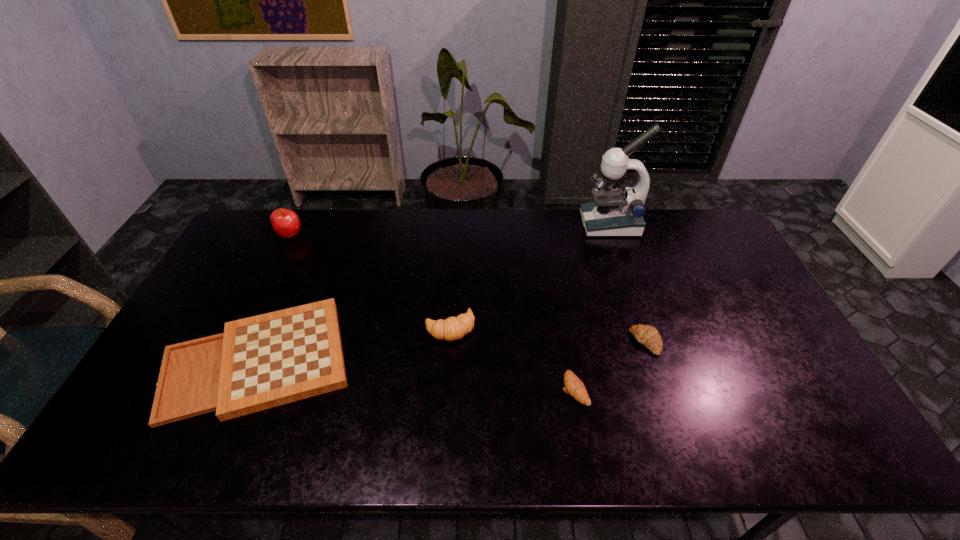
This screenshot has width=960, height=540. Find the location of `free space between the third tallest object and the apple`. free space between the third tallest object and the apple is located at coordinates (371, 281).

Find the location of a particular element. This screenshot has height=540, width=960. vacant area that lies between the fourth shortest object and the apple is located at coordinates (371, 281).

You are a GUI agent. You are given a task and a screenshot of the screen. Output one action in this format:
    pyautogui.click(x=<x>, y=<y>)
    Task: Click on the vacant space that's between the rightmost crescent roll and the fourth object from left to right
    The height and width of the screenshot is (540, 960).
    Given the screenshot: What is the action you would take?
    pyautogui.click(x=611, y=366)

Where is `free space between the rightmost crescent roll and the nearest crescent roll`? free space between the rightmost crescent roll and the nearest crescent roll is located at coordinates (611, 366).

Identify the location of empty location between the shortest crescent roll and the third shortest object. This screenshot has height=540, width=960. (611, 366).

Where is `vacant area that lies between the nearest crescent roll and the third tallest object`? The image size is (960, 540). vacant area that lies between the nearest crescent roll and the third tallest object is located at coordinates (513, 359).

Identify the location of vacant space that is in between the second shortest crescent roll and the fourth object from right to left. (548, 335).

Find the location of a particular element. This screenshot has height=540, width=960. vacant space that is in between the fourth object from right to left and the gameboard is located at coordinates (354, 344).

The height and width of the screenshot is (540, 960). I want to click on free space between the third shortest object and the second tallest object, so click(468, 288).

This screenshot has width=960, height=540. In order to click on empty space between the microscope and the second shortest crescent roll in this screenshot , I will do `click(628, 283)`.